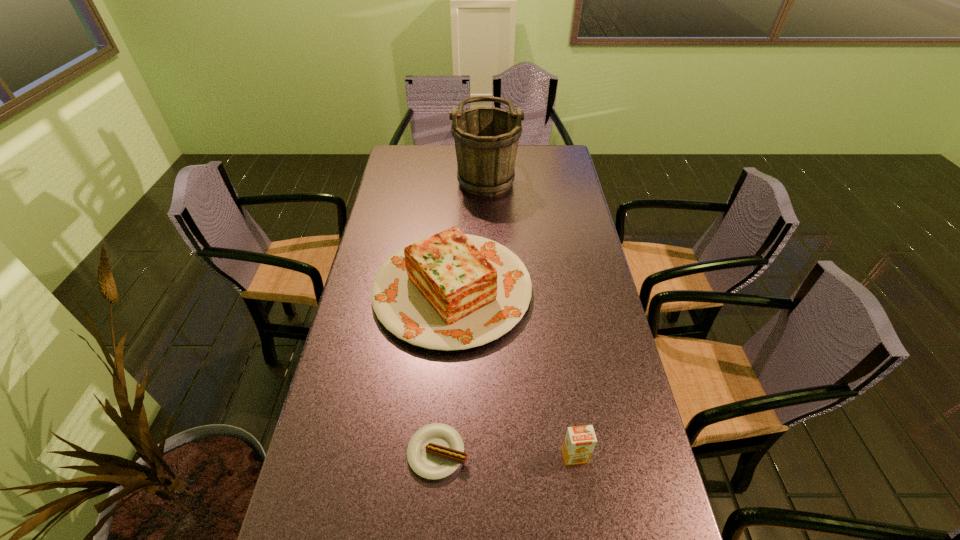
Select which object appears as the second closest to the third nearest object. Please provide its 2D coordinates. Your answer should be formatted as a tuple, i.e. [(x, y)], where the tuple contains the x and y coordinates of a point satisfying the conditions above.

[(486, 139)]

At what (x,y) coordinates should I click in order to perform the action: click on vacant point that satisfies the following two spatial constraints: 1. on the handle side of the farthest object; 2. on the left side of the orange juice. Please return your answer as a coordinate pair (x, y). The image size is (960, 540). Looking at the image, I should click on (491, 456).

At what (x,y) coordinates should I click in order to perform the action: click on vacant space that satisfies the following two spatial constraints: 1. on the handle side of the third tallest object; 2. on the left side of the farthest object. Please return your answer as a coordinate pair (x, y). The image size is (960, 540). Looking at the image, I should click on (491, 456).

Locate an element on the screen. The image size is (960, 540). free space that satisfies the following two spatial constraints: 1. on the front side of the rightmost object; 2. on the right side of the shortest object is located at coordinates (437, 456).

Locate an element on the screen. Image resolution: width=960 pixels, height=540 pixels. free spot that satisfies the following two spatial constraints: 1. on the front side of the lasagna; 2. on the right side of the orange juice is located at coordinates (442, 456).

The width and height of the screenshot is (960, 540). Identify the location of vacant space that satisfies the following two spatial constraints: 1. on the front side of the shortest object; 2. on the right side of the orange juice. (437, 456).